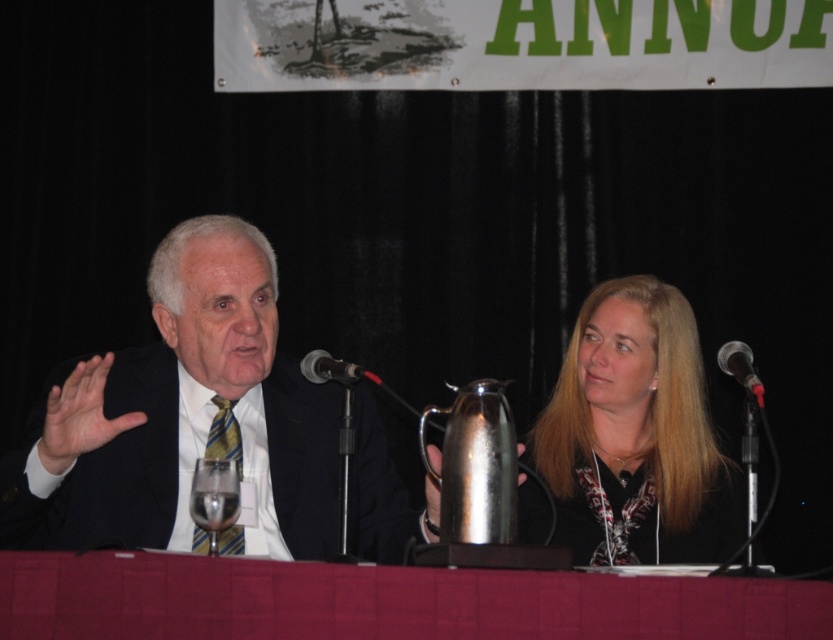
Question: Which point is closer to the camera?

Choices:
 (A) smooth red tablecloth at center
 (B) smooth black hair at center
 (C) clear glass wine glass at center
 (D) black metallic microphone at center

Answer: (A)

Question: Does matte black suit at center appear under metallic/matte microphone at right?

Choices:
 (A) no
 (B) yes

Answer: (B)

Question: Which point appears closest to the camera in this image?

Choices:
 (A) (x=353, y=368)
 (B) (x=641, y=353)
 (C) (x=183, y=244)

Answer: (A)

Question: In this image, where is smooth black hair at center located relative to metallic/matte microphone at right?

Choices:
 (A) above
 (B) below

Answer: (B)

Question: Does clear glass wine glass at center come in front of metallic/matte microphone at right?

Choices:
 (A) no
 (B) yes

Answer: (B)

Question: Which of the following is the farthest from the observer?

Choices:
 (A) smooth red tablecloth at center
 (B) metallic/matte microphone at right
 (C) smooth black hair at center

Answer: (C)